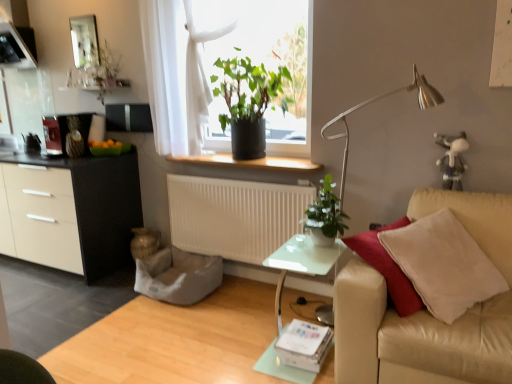
Question: Is green matte plant at upper center, the 2th houseplant in the right-to-left sequence, surrounded by white matte radiator at center?

Choices:
 (A) yes
 (B) no

Answer: (B)

Question: From the image's perspective, is white matte radiator at center under green matte plant at upper center, the 2th houseplant in the right-to-left sequence?

Choices:
 (A) no
 (B) yes

Answer: (B)

Question: Is white matte radiator at center thinner than green matte plant at upper center, the second houseplant from the bottom?

Choices:
 (A) no
 (B) yes

Answer: (B)

Question: Is white matte radiator at center facing towards green matte plant at upper center, the 1th houseplant positioned from the back?

Choices:
 (A) yes
 (B) no

Answer: (B)

Question: Is white matte radiator at center closer to camera compared to green matte plant at upper center, the second houseplant from the bottom?

Choices:
 (A) yes
 (B) no

Answer: (B)

Question: Considering the positions of gray fabric swivel chair at lower center and smooth beige couch at right in the image, is gray fabric swivel chair at lower center taller or shorter than smooth beige couch at right?

Choices:
 (A) tall
 (B) short

Answer: (A)

Question: Is gray fabric swivel chair at lower center to the left or to the right of smooth beige couch at right in the image?

Choices:
 (A) left
 (B) right

Answer: (B)

Question: From a real-world perspective, is gray fabric swivel chair at lower center physically located above or below smooth beige couch at right?

Choices:
 (A) above
 (B) below

Answer: (A)

Question: Considering the positions of point (157, 284) and point (145, 301), is point (157, 284) closer or farther from the camera than point (145, 301)?

Choices:
 (A) farther
 (B) closer

Answer: (A)

Question: Does point (361, 284) appear closer or farther from the camera than point (172, 185)?

Choices:
 (A) farther
 (B) closer

Answer: (B)

Question: Is beige leather couch at right taller or shorter than white matte radiator at center?

Choices:
 (A) short
 (B) tall

Answer: (B)

Question: Considering the positions of beige leather couch at right and white matte radiator at center in the image, is beige leather couch at right bigger or smaller than white matte radiator at center?

Choices:
 (A) big
 (B) small

Answer: (A)

Question: From the image's perspective, is beige leather couch at right positioned above or below white matte radiator at center?

Choices:
 (A) above
 (B) below

Answer: (B)

Question: Would you say beige leather couch at right is inside or outside matte silver mirror at upper left?

Choices:
 (A) inside
 (B) outside

Answer: (B)

Question: In terms of width, does beige leather couch at right look wider or thinner when compared to matte silver mirror at upper left?

Choices:
 (A) wide
 (B) thin

Answer: (A)